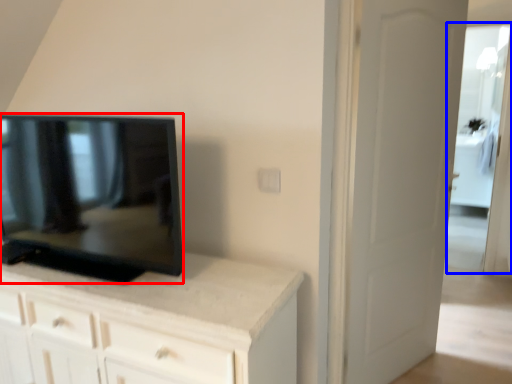
Question: Which object appears closest to the camera in this image, television (highlighted by a red box) or glass door (highlighted by a blue box)?

Choices:
 (A) television
 (B) glass door

Answer: (A)